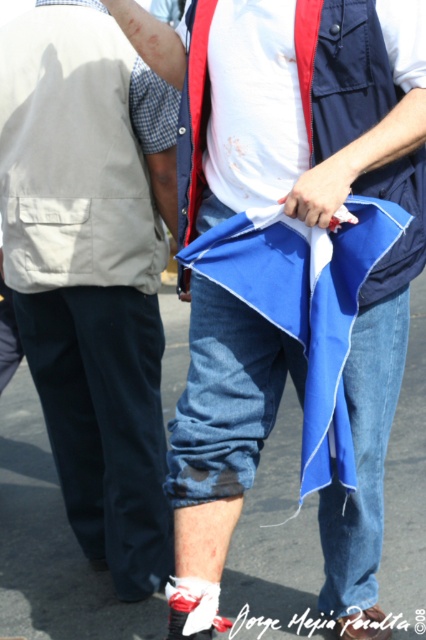
You are a detective analyzing the scene. You notice the matte khaki vest at left and the blue fabric flag at lower center. Which object is bigger in size?

The matte khaki vest at left is larger in size than the blue fabric flag at lower center.

You are a detective examining the scene. The matte khaki vest at left and the blue fabric flag at lower center are both important clues. Which item is covering the other one?

The matte khaki vest at left is positioned over the blue fabric flag at lower center, meaning the vest is covering the flag.